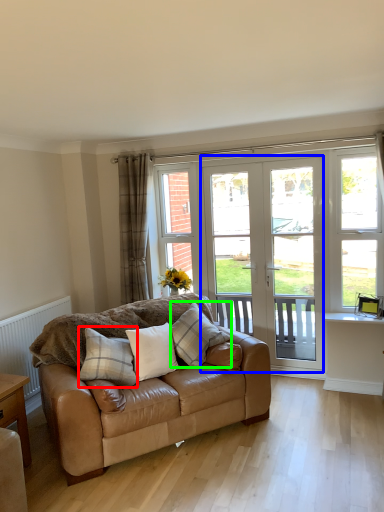
Question: Which object is positioned closest to pillow (highlighted by a red box)? Select from screen door (highlighted by a blue box) and pillow (highlighted by a green box).

Choices:
 (A) screen door
 (B) pillow

Answer: (B)